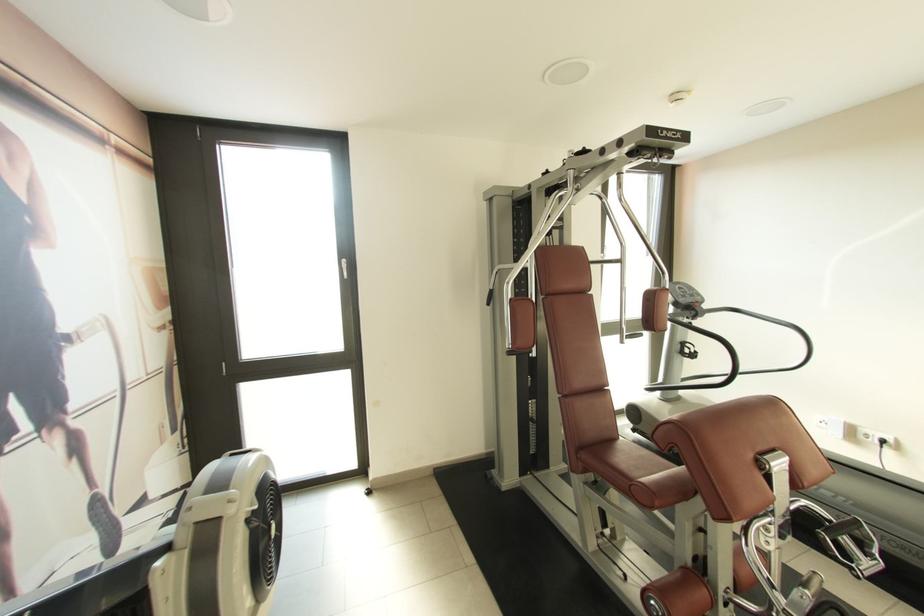
Find where to pull the black power plug. Please return your answer as a coordinate pair (x, y).

(881, 447)